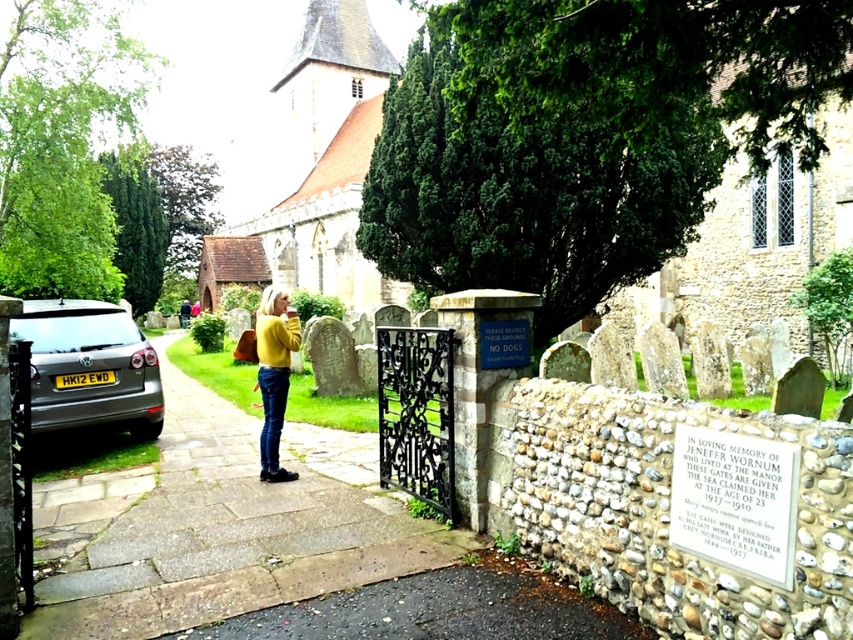
You are standing at the entrance of the graveyard and want to take a photo of the church in the background. The camera you are using has a focal length of 50mm. If you want to include the woman holding the yellow top and dark pants in your shot without moving closer, what is the minimum distance you should be from the point at coordinates point (345,160)?

The minimum distance you should be from the point at coordinates point (345,160) is 164.49 feet to ensure the woman is in frame while capturing the church in the background.

Based on the scene description, where is the silver metallic car at left located in relation to the graveyard entrance?

The silver metallic car at left is located at point (90, 368).

You are standing at the entrance of the graveyard and want to take a photo of the stone textured church at center. If your camera has a maximum focus range of 8 meters, will you be able to capture the church clearly?

The stone textured church at center is 7.73 meters away from the camera. Since the maximum focus range is 8 meters, the camera can focus on the church at that distance, so yes, you can capture it clearly.